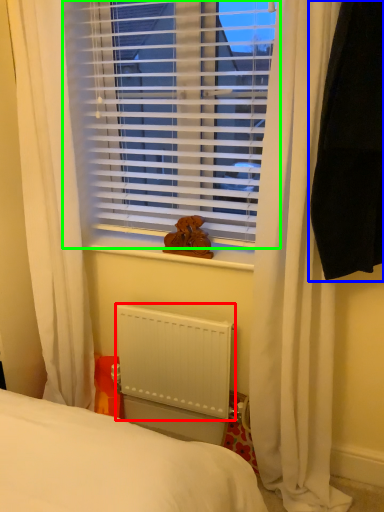
Question: Which object is the closest to the radiator (highlighted by a red box)? Choose among these: curtain (highlighted by a blue box) or window blind (highlighted by a green box).

Choices:
 (A) curtain
 (B) window blind

Answer: (B)